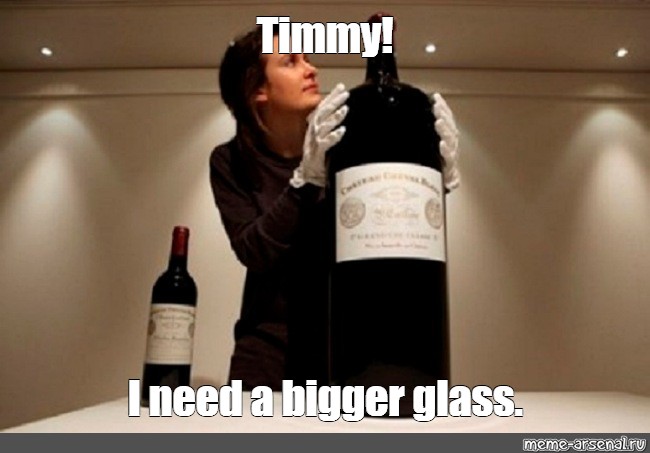
The width and height of the screenshot is (650, 453). Find the location of `table`. table is located at coordinates (580, 402).